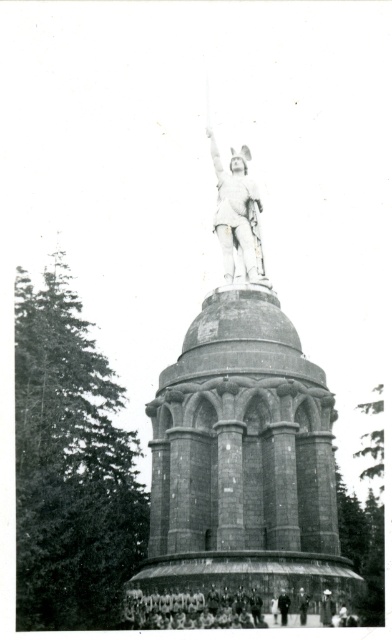
Question: Which point is closer to the camera?

Choices:
 (A) click(x=226, y=248)
 (B) click(x=279, y=600)
 (C) click(x=194, y=627)

Answer: (C)

Question: Which point is farther from the camera taking this photo?

Choices:
 (A) (250, 241)
 (B) (315, 394)
 (C) (172, 608)
 (D) (279, 608)

Answer: (A)

Question: Among these points, which one is nearest to the camera?

Choices:
 (A) (154, 618)
 (B) (277, 573)
 (C) (219, 243)

Answer: (B)

Question: Can you confirm if polished bronze statue at center is bigger than white statue at center?

Choices:
 (A) yes
 (B) no

Answer: (A)

Question: In this image, where is polished bronze statue at center located relative to dark gray uniform at center?

Choices:
 (A) below
 (B) above

Answer: (B)

Question: Can you confirm if white stone statue at center is positioned above dark gray uniform at center?

Choices:
 (A) no
 (B) yes

Answer: (B)